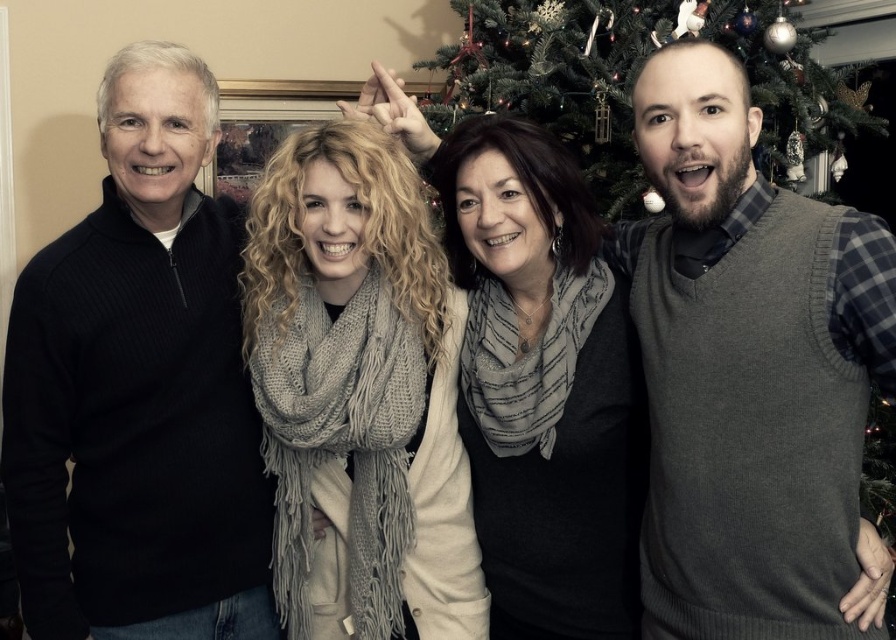
Question: Which object appears farthest from the camera in this image?

Choices:
 (A) gray knitted vest at right
 (B) black sweater at left
 (C) gray scarf at center
 (D) knitted scarf at center

Answer: (C)

Question: Estimate the real-world distances between objects in this image. Which object is farther from the green textured christmas tree at upper center?

Choices:
 (A) gray knitted vest at right
 (B) gray scarf at center

Answer: (A)

Question: Which object is the closest to the gray scarf at center?

Choices:
 (A) gray knitted vest at right
 (B) black sweater at left
 (C) knitted scarf at center
 (D) green textured christmas tree at upper center

Answer: (C)

Question: Does knitted scarf at center appear over green textured christmas tree at upper center?

Choices:
 (A) no
 (B) yes

Answer: (A)

Question: Does gray knitted vest at right appear under knitted scarf at center?

Choices:
 (A) no
 (B) yes

Answer: (A)

Question: Does black sweater at left have a smaller size compared to gray scarf at center?

Choices:
 (A) yes
 (B) no

Answer: (B)